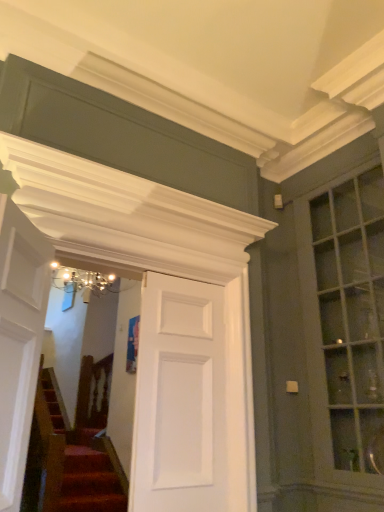
Question: Which is correct: white glossy door at left, which ranks as the 1th door in front-to-back order, is inside matte glass window at right, or outside of it?

Choices:
 (A) inside
 (B) outside

Answer: (B)

Question: Considering the positions of white glossy door at left, the 2th door from the right, and matte glass window at right in the image, is white glossy door at left, the 2th door from the right, wider or thinner than matte glass window at right?

Choices:
 (A) wide
 (B) thin

Answer: (B)

Question: Based on their relative distances, which object is farther from the white glossy door at left, positioned as the first door in left-to-right order?

Choices:
 (A) matte glass window at right
 (B) white matte door at center, which is the 1th door from back to front

Answer: (A)

Question: Which is farther from the white matte door at center, placed as the 2th door when sorted from front to back?

Choices:
 (A) white glossy door at left, the 2th door from the right
 (B) matte glass window at right

Answer: (B)